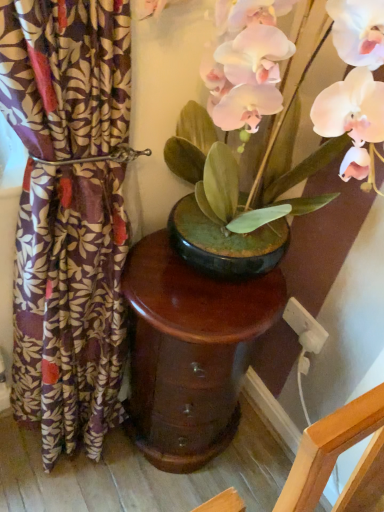
Question: Is point (316, 326) positioned closer to the camera than point (334, 99)?

Choices:
 (A) farther
 (B) closer

Answer: (A)

Question: In terms of size, does white plastic electric outlet at lower right appear bigger or smaller than matte black pot at center?

Choices:
 (A) small
 (B) big

Answer: (A)

Question: Considering the real-world distances, which object is closest to the matte black pot at center?

Choices:
 (A) patterned fabric curtain at left
 (B) white plastic electric outlet at lower right
 (C) glossy wood table at center

Answer: (A)

Question: Which object is the closest to the glossy wood table at center?

Choices:
 (A) matte black pot at center
 (B) white plastic electric outlet at lower right
 (C) patterned fabric curtain at left

Answer: (C)